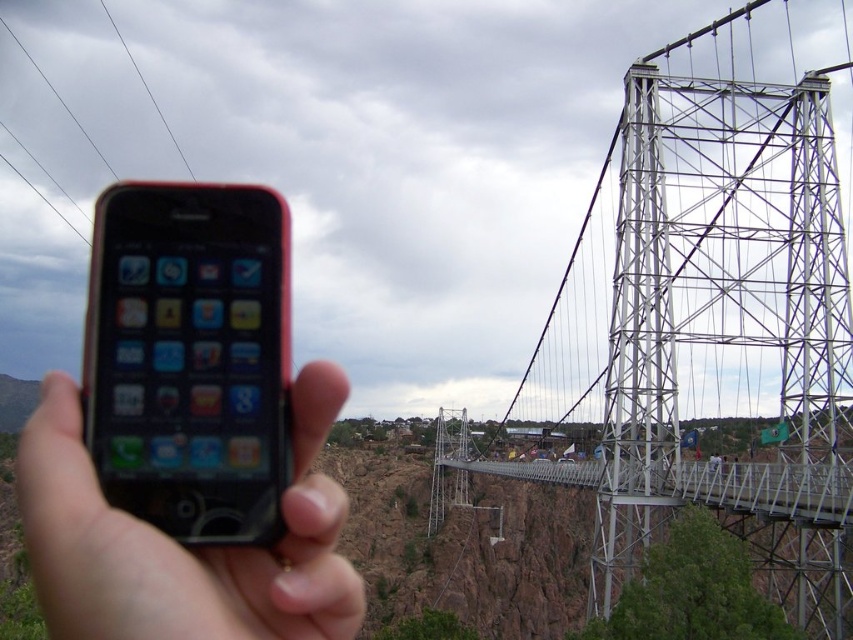
You are a photographer trying to capture the metallic silver suspension bridge at center without any obstructions. However, the black wire at upper left is blocking your view. Can you adjust your camera angle to avoid the wire?

The metallic silver suspension bridge at center is positioned under the black wire at upper left, so tilting the camera downward slightly would allow you to capture the bridge without the wire obstructing the view.

You are a photographer trying to capture the suspension bridge in the image. You notice the metallic silver suspension bridge at center and the black wire at upper left in your viewfinder. Which object appears wider in the photo?

The metallic silver suspension bridge at center appears wider in the photo because its width is larger than the black wire at upper left.

You are a photographer trying to capture the metallic silver suspension bridge at center and the black wire at upper left in a single shot. Based on their positions, which object should you focus on first to ensure both are in sharp focus?

A: The metallic silver suspension bridge at center is closer to the viewer than the black wire at upper left. To ensure both are in sharp focus, you should focus on the metallic silver suspension bridge at center first, as it is the closer object.